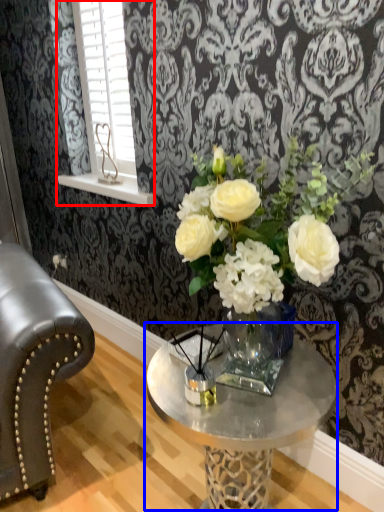
Question: Which object appears farthest to the camera in this image, window (highlighted by a red box) or coffee table (highlighted by a blue box)?

Choices:
 (A) window
 (B) coffee table

Answer: (A)